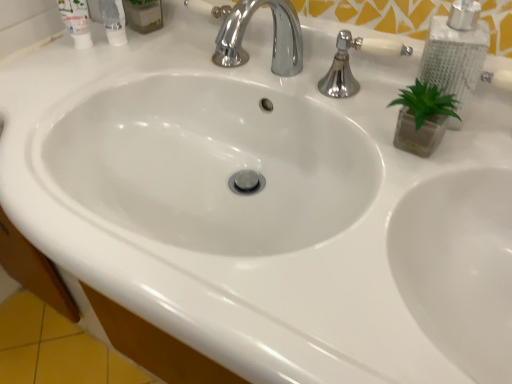
Where is `free space to the left of chrome metallic faucet at upper center`? Image resolution: width=512 pixels, height=384 pixels. free space to the left of chrome metallic faucet at upper center is located at coordinates (166, 77).